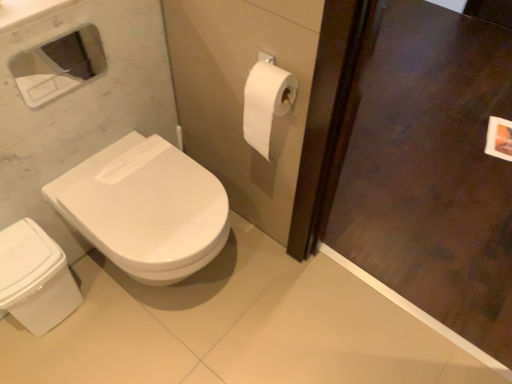
Question: From a real-world perspective, is white glossy bidet at lower left positioned above or below white glossy medicine cabinet at upper left?

Choices:
 (A) above
 (B) below

Answer: (B)

Question: Relative to white glossy medicine cabinet at upper left, is white glossy bidet at lower left in front or behind?

Choices:
 (A) behind
 (B) front

Answer: (A)

Question: Which object is positioned farthest from the white glossy bidet at lower left?

Choices:
 (A) dark wood screen door at right
 (B) white glossy toilet at lower left
 (C) white glossy medicine cabinet at upper left

Answer: (A)

Question: Which object is positioned farthest from the white glossy medicine cabinet at upper left?

Choices:
 (A) white glossy toilet at lower left
 (B) dark wood screen door at right
 (C) white glossy bidet at lower left

Answer: (B)